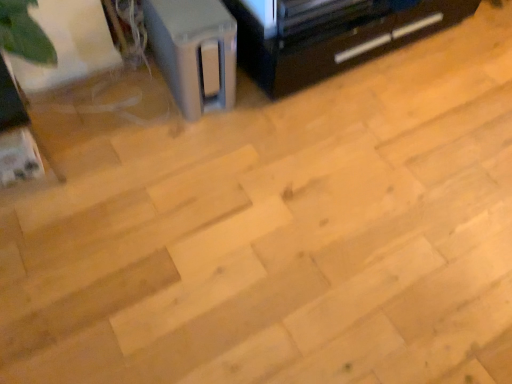
Identify the location of unoccupied area in front of satin gray speaker at upper left. (176, 134).